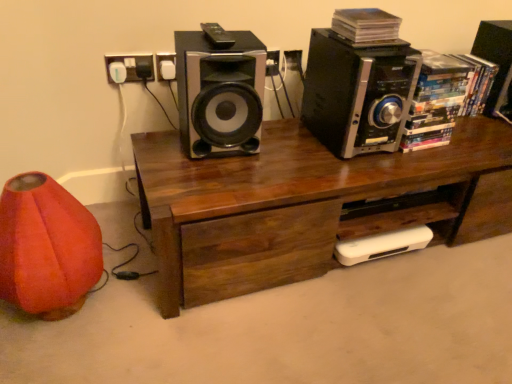
Find the location of a particular element. free point in front of orange fabric bean bag chair at lower left is located at coordinates (51, 359).